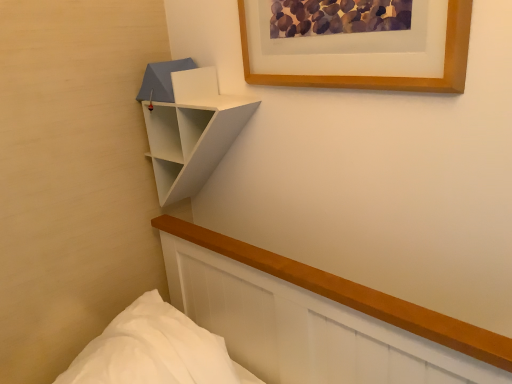
Locate an element on the screen. The height and width of the screenshot is (384, 512). wooden picture frame at upper center is located at coordinates [x=380, y=76].

Measure the distance between wooden picture frame at upper center and camera.

wooden picture frame at upper center is 26.35 inches away from camera.

The width and height of the screenshot is (512, 384). What do you see at coordinates (380, 76) in the screenshot? I see `wooden picture frame at upper center` at bounding box center [380, 76].

Identify the location of white matte/shiny shelf at upper center. click(x=188, y=127).

What is the approximate height of white matte/shiny shelf at upper center?

The height of white matte/shiny shelf at upper center is 41.52 centimeters.

Image resolution: width=512 pixels, height=384 pixels. What do you see at coordinates (188, 127) in the screenshot?
I see `white matte/shiny shelf at upper center` at bounding box center [188, 127].

You are a GUI agent. You are given a task and a screenshot of the screen. Output one action in this format:
    pyautogui.click(x=<x>, y=<y>)
    Task: Click on the wooden picture frame at upper center
    This screenshot has height=384, width=512.
    Given the screenshot: What is the action you would take?
    pyautogui.click(x=380, y=76)

Considering the positions of objects white matte/shiny shelf at upper center and wooden picture frame at upper center in the image provided, who is more to the left, white matte/shiny shelf at upper center or wooden picture frame at upper center?

white matte/shiny shelf at upper center is more to the left.

Based on the photo, which object is further away from the camera, white matte/shiny shelf at upper center or wooden picture frame at upper center?

white matte/shiny shelf at upper center is more distant.

Which is farther from the camera, [234,128] or [467,16]?

The point [234,128] is farther from the camera.

From the image's perspective, would you say white matte/shiny shelf at upper center is positioned over wooden picture frame at upper center?

No.

From a real-world perspective, is white matte/shiny shelf at upper center positioned under wooden picture frame at upper center based on gravity?

Indeed, from a real-world perspective, white matte/shiny shelf at upper center is positioned beneath wooden picture frame at upper center.

Looking at their sizes, would you say white matte/shiny shelf at upper center is wider or thinner than wooden picture frame at upper center?

white matte/shiny shelf at upper center is wider than wooden picture frame at upper center.

Considering the relative sizes of white matte/shiny shelf at upper center and wooden picture frame at upper center in the image provided, is white matte/shiny shelf at upper center taller than wooden picture frame at upper center?

Yes, white matte/shiny shelf at upper center is taller than wooden picture frame at upper center.

Does white matte/shiny shelf at upper center have a larger size compared to wooden picture frame at upper center?

Yes.

Is white matte/shiny shelf at upper center positioned beyond the bounds of wooden picture frame at upper center?

white matte/shiny shelf at upper center is positioned outside wooden picture frame at upper center.

Can you see white matte/shiny shelf at upper center touching wooden picture frame at upper center?

They are not placed beside each other.

Is white matte/shiny shelf at upper center positioned with its back to wooden picture frame at upper center?

No.

Measure the distance between white matte/shiny shelf at upper center and wooden picture frame at upper center.

white matte/shiny shelf at upper center and wooden picture frame at upper center are 9.95 inches apart from each other.

Identify the location of shelf behind the wooden picture frame at upper center. Image resolution: width=512 pixels, height=384 pixels. (188, 127).

Is wooden picture frame at upper center at the right side of white matte/shiny shelf at upper center?

Yes, wooden picture frame at upper center is to the right of white matte/shiny shelf at upper center.

Which is behind, wooden picture frame at upper center or white matte/shiny shelf at upper center?

Positioned behind is white matte/shiny shelf at upper center.

Does point (448, 80) lie behind point (183, 192)?

No, (448, 80) is in front of (183, 192).

From the image's perspective, is wooden picture frame at upper center above or below white matte/shiny shelf at upper center?

wooden picture frame at upper center is situated higher than white matte/shiny shelf at upper center in the image.

From a real-world perspective, which is physically below, wooden picture frame at upper center or white matte/shiny shelf at upper center?

In real-world perspective, white matte/shiny shelf at upper center is lower.

Between wooden picture frame at upper center and white matte/shiny shelf at upper center, which one has smaller width?

Thinner between the two is wooden picture frame at upper center.

Considering the relative sizes of wooden picture frame at upper center and white matte/shiny shelf at upper center in the image provided, is wooden picture frame at upper center shorter than white matte/shiny shelf at upper center?

Correct, wooden picture frame at upper center is not as tall as white matte/shiny shelf at upper center.

Looking at the image, does wooden picture frame at upper center seem bigger or smaller compared to white matte/shiny shelf at upper center?

Considering their sizes, wooden picture frame at upper center takes up less space than white matte/shiny shelf at upper center.

Is wooden picture frame at upper center inside the boundaries of white matte/shiny shelf at upper center, or outside?

wooden picture frame at upper center exists outside the volume of white matte/shiny shelf at upper center.

Is wooden picture frame at upper center not close to white matte/shiny shelf at upper center?

No.

Is wooden picture frame at upper center oriented away from white matte/shiny shelf at upper center?

No, wooden picture frame at upper center is not facing the opposite direction of white matte/shiny shelf at upper center.

What's the angular difference between wooden picture frame at upper center and white matte/shiny shelf at upper center's facing directions?

The facing directions of wooden picture frame at upper center and white matte/shiny shelf at upper center are 2.61 degrees apart.

Image resolution: width=512 pixels, height=384 pixels. I want to click on picture frame above the white matte/shiny shelf at upper center (from the image's perspective), so click(380, 76).

The height and width of the screenshot is (384, 512). Find the location of `picture frame located above the white matte/shiny shelf at upper center (from the image's perspective)`. picture frame located above the white matte/shiny shelf at upper center (from the image's perspective) is located at coordinates (380, 76).

Identify the location of shelf that is on the left side of wooden picture frame at upper center. This screenshot has height=384, width=512. (188, 127).